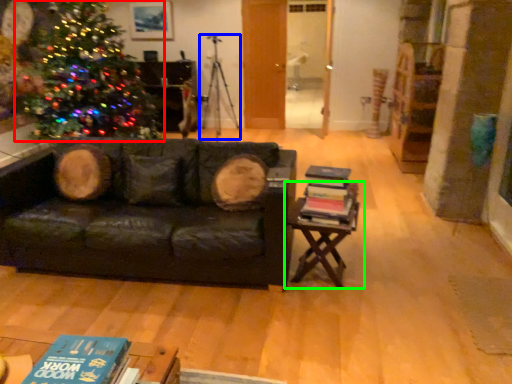
Question: Estimate the real-world distances between objects in this image. Which object is farther from christmas tree (highlighted by a red box), tripod (highlighted by a blue box) or table (highlighted by a green box)?

Choices:
 (A) tripod
 (B) table

Answer: (B)